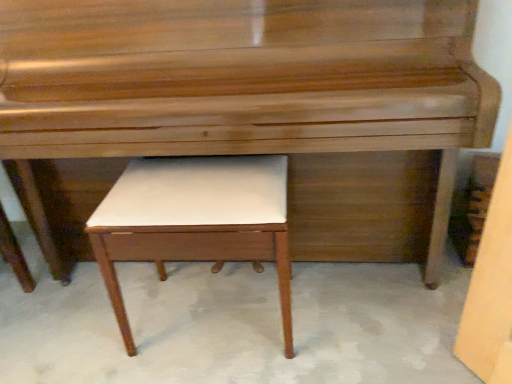
This screenshot has width=512, height=384. I want to click on blank space situated above white leather stool at center (from a real-world perspective), so click(x=201, y=169).